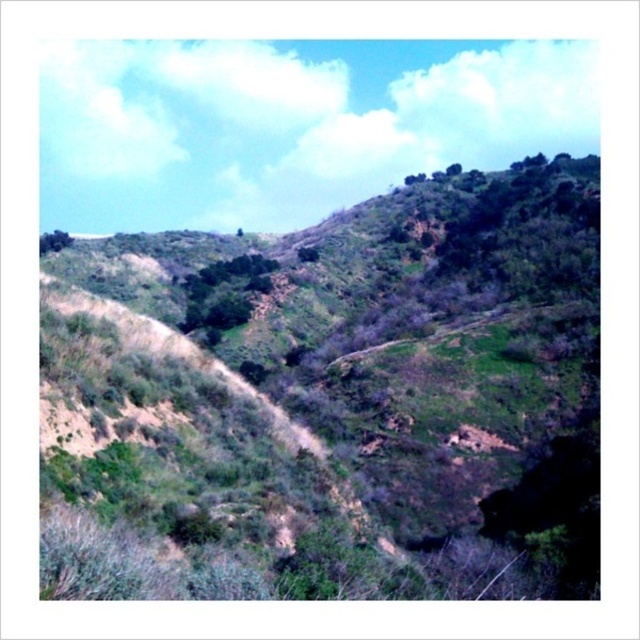
You are a hiker trying to navigate between two green leafy trees in a hilly landscape. The trees are the green leafy tree at center and the green leafy tree at upper left. Which tree has a wider spread of branches and leaves?

The green leafy tree at center has a wider spread of branches and leaves compared to the green leafy tree at upper left, as its width surpasses the other.

You are a hiker planning to take a photo of the green leafy tree at center and the green leafy tree at upper left. Which tree should you stand closer to in order to capture both in a single frame without zooming?

You should stand closer to the green leafy tree at upper left because it is shorter than the green leafy tree at center, allowing both to fit within the frame when positioned appropriately.

You are standing at the base of the green grassy hillside at center and want to reach the green leafy tree at center. Which direction should you move to get closer to the tree?

The green grassy hillside at center is in front of the green leafy tree at center, so you should move forward towards the green grassy hillside at center to get closer to the tree.